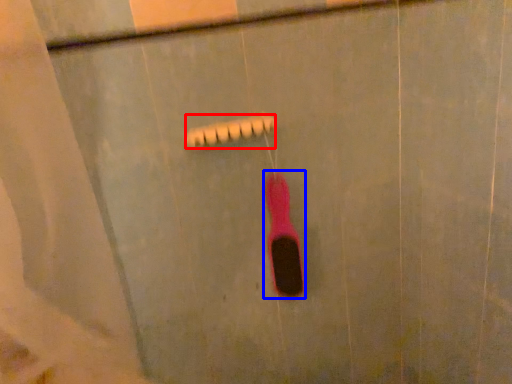
Question: Which object is closer to the camera taking this photo, shower (highlighted by a red box) or toothbrush (highlighted by a blue box)?

Choices:
 (A) shower
 (B) toothbrush

Answer: (A)